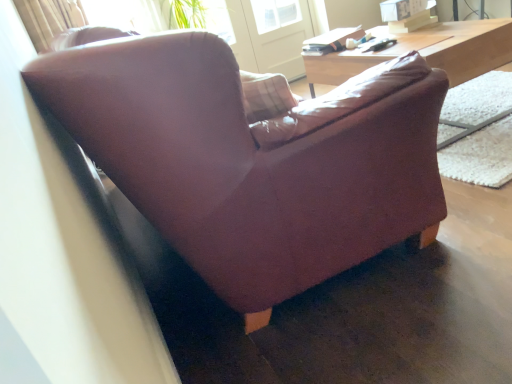
The height and width of the screenshot is (384, 512). What do you see at coordinates (254, 160) in the screenshot?
I see `leather couch at center` at bounding box center [254, 160].

Find the location of a particular element. transparent glass screen door at upper center is located at coordinates (278, 34).

This screenshot has height=384, width=512. Find the location of `wooden desk at upper right`. wooden desk at upper right is located at coordinates (425, 51).

Considering the positions of points (290, 36) and (453, 29), is point (290, 36) farther from camera compared to point (453, 29)?

Yes, it is behind point (453, 29).

Is transparent glass screen door at upper center shorter than wooden desk at upper right?

No.

Considering the sizes of objects transparent glass screen door at upper center and wooden desk at upper right in the image provided, who is bigger, transparent glass screen door at upper center or wooden desk at upper right?

wooden desk at upper right.

Is transparent glass screen door at upper center positioned far away from wooden desk at upper right?

Indeed, transparent glass screen door at upper center is not near wooden desk at upper right.

How many degrees apart are the facing directions of wooden desk at upper right and leather couch at center?

179 degrees separate the facing orientations of wooden desk at upper right and leather couch at center.

From the picture: Is wooden desk at upper right aimed at leather couch at center?

No, wooden desk at upper right is not aimed at leather couch at center.

The height and width of the screenshot is (384, 512). In the image, there is a wooden desk at upper right. In order to click on studio couch below it (from a real-world perspective) in this screenshot , I will do [x=254, y=160].

Is point (376, 52) farther from camera compared to point (125, 110)?

Yes.

How distant is leather couch at center from wooden desk at upper right?

leather couch at center and wooden desk at upper right are 1.09 meters apart.

From a real-world perspective, is leather couch at center above or below wooden desk at upper right?

In terms of real-world spatial position, leather couch at center is below wooden desk at upper right.

In the image, there is a wooden desk at upper right. Identify the location of studio couch below it (from a real-world perspective). The image size is (512, 384). (254, 160).

Can you tell me how much leather couch at center and wooden desk at upper right differ in facing direction?

The angular difference between leather couch at center and wooden desk at upper right is 179 degrees.

Is leather couch at center with transparent glass screen door at upper center?

No, leather couch at center is not beside transparent glass screen door at upper center.

Based on their positions, is leather couch at center located to the left or right of transparent glass screen door at upper center?

Based on their positions, leather couch at center is located to the right of transparent glass screen door at upper center.

Does leather couch at center have a smaller size compared to transparent glass screen door at upper center?

No, leather couch at center is not smaller than transparent glass screen door at upper center.

Is leather couch at center facing towards transparent glass screen door at upper center?

No, leather couch at center is not turned towards transparent glass screen door at upper center.

Is wooden desk at upper right closer to camera compared to transparent glass screen door at upper center?

Yes, wooden desk at upper right is closer to the camera.

Which of these two, wooden desk at upper right or transparent glass screen door at upper center, is smaller?

Smaller between the two is transparent glass screen door at upper center.

In terms of height, does wooden desk at upper right look taller or shorter compared to transparent glass screen door at upper center?

Considering their sizes, wooden desk at upper right has less height than transparent glass screen door at upper center.

Who is smaller, transparent glass screen door at upper center or leather couch at center?

transparent glass screen door at upper center is smaller.

Does transparent glass screen door at upper center contain leather couch at center?

No, transparent glass screen door at upper center does not contain leather couch at center.

Is transparent glass screen door at upper center not near leather couch at center?

Absolutely, transparent glass screen door at upper center is distant from leather couch at center.

Image resolution: width=512 pixels, height=384 pixels. I want to click on screen door on the left of leather couch at center, so click(x=278, y=34).

Where is `table below the transparent glass screen door at upper center (from the image's perspective)`? The image size is (512, 384). table below the transparent glass screen door at upper center (from the image's perspective) is located at coordinates (425, 51).

Locate an element on the screen. This screenshot has height=384, width=512. studio couch below the wooden desk at upper right (from a real-world perspective) is located at coordinates (254, 160).

Considering their positions, is wooden desk at upper right positioned closer to transparent glass screen door at upper center than leather couch at center?

wooden desk at upper right lies closer to transparent glass screen door at upper center than the other object.

Consider the image. Considering their positions, is transparent glass screen door at upper center positioned further to leather couch at center than wooden desk at upper right?

transparent glass screen door at upper center is positioned further to the anchor leather couch at center.

When comparing their distances from leather couch at center, does wooden desk at upper right or transparent glass screen door at upper center seem further?

Among the two, transparent glass screen door at upper center is located further to leather couch at center.

Looking at the image, which one is located closer to transparent glass screen door at upper center, leather couch at center or wooden desk at upper right?

wooden desk at upper right is closer to transparent glass screen door at upper center.

Looking at the image, which one is located closer to wooden desk at upper right, transparent glass screen door at upper center or leather couch at center?

leather couch at center is closer to wooden desk at upper right.

Based on their spatial positions, is leather couch at center or transparent glass screen door at upper center further from wooden desk at upper right?

Among the two, transparent glass screen door at upper center is located further to wooden desk at upper right.

Where is `table positioned between leather couch at center and transparent glass screen door at upper center from near to far`? table positioned between leather couch at center and transparent glass screen door at upper center from near to far is located at coordinates (425, 51).